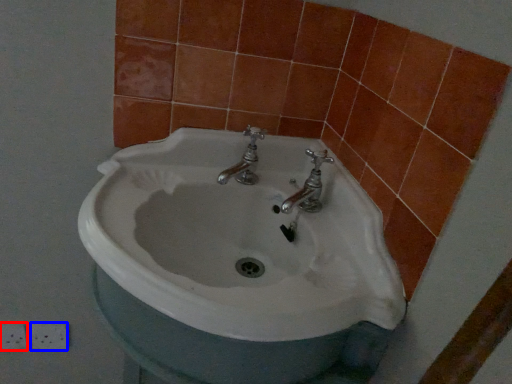
Question: Among these objects, which one is farthest to the camera, ceramic tile (highlighted by a red box) or ceramic tile (highlighted by a blue box)?

Choices:
 (A) ceramic tile
 (B) ceramic tile

Answer: (B)